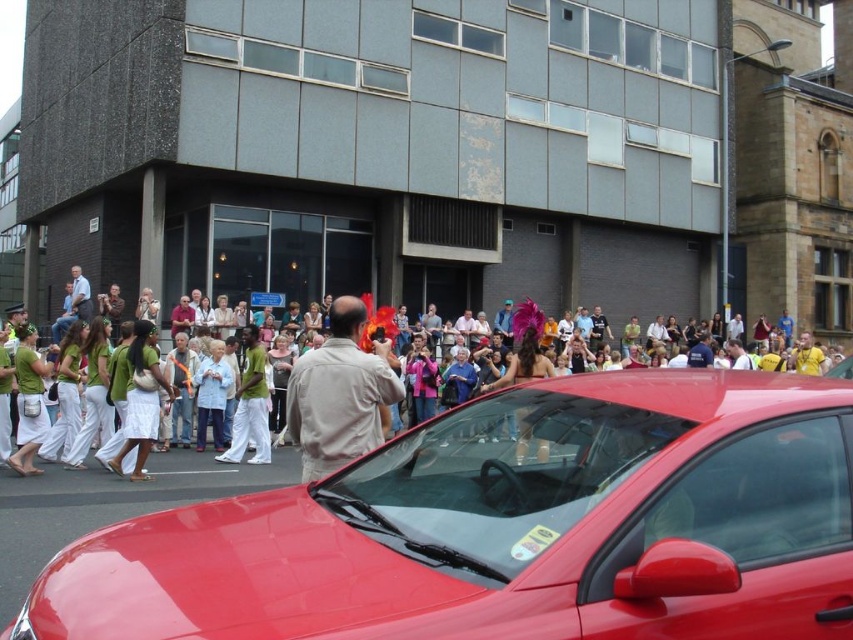
Can you confirm if glossy red car at center is positioned to the right of matte khaki shirt at center?

Correct, you'll find glossy red car at center to the right of matte khaki shirt at center.

Is glossy red car at center positioned behind matte khaki shirt at center?

No, it is in front of matte khaki shirt at center.

Does point (839, 428) lie behind point (521, 464)?

That is False.

Locate an element on the screen. The height and width of the screenshot is (640, 853). glossy red car at center is located at coordinates (509, 528).

Does glossy red car at center appear on the right side of light brown cotton shirt at center?

Yes, glossy red car at center is to the right of light brown cotton shirt at center.

Does glossy red car at center have a greater height compared to light brown cotton shirt at center?

In fact, glossy red car at center may be shorter than light brown cotton shirt at center.

Describe the element at coordinates (509, 528) in the screenshot. I see `glossy red car at center` at that location.

Locate an element on the screen. This screenshot has height=640, width=853. glossy red car at center is located at coordinates (509, 528).

Between glossy red car at center and white cotton pants at center, which one is positioned lower?

white cotton pants at center is lower down.

How distant is glossy red car at center from white cotton pants at center?

The distance of glossy red car at center from white cotton pants at center is 9.19 meters.

I want to click on glossy red car at center, so click(x=509, y=528).

Locate an element on the screen. The height and width of the screenshot is (640, 853). glossy red car at center is located at coordinates (509, 528).